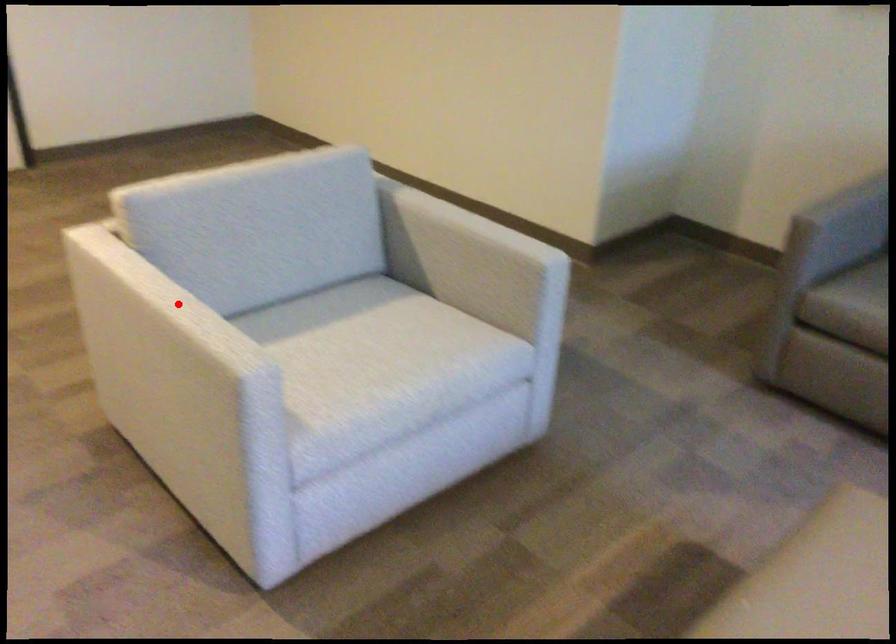
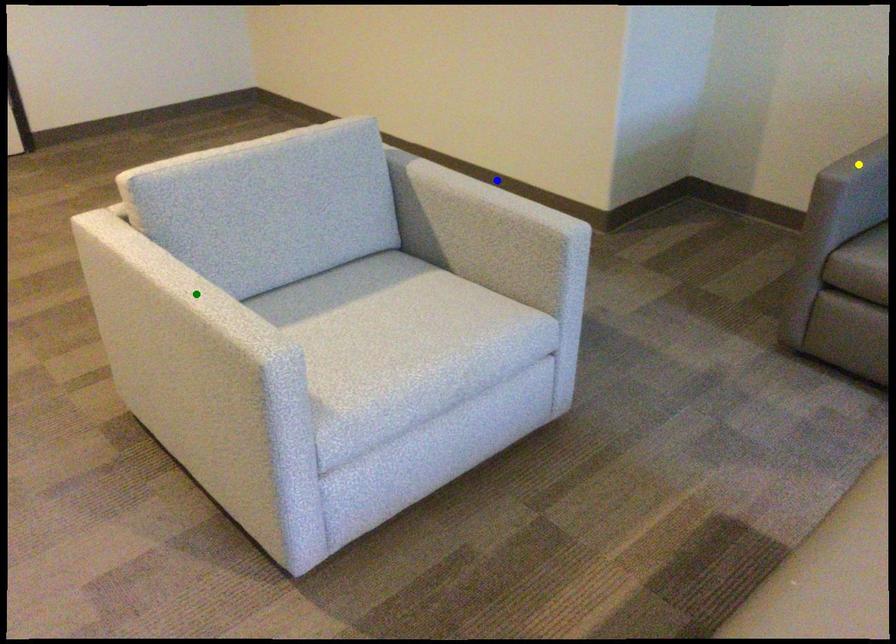
Question: I am providing you with two images of the same scene from different viewpoints. A red point is marked on the first image. You are given multiple points on the second image. Which point in image 2 is actually the same real-world point as the red point in image 1?

Choices:
 (A) blue point
 (B) green point
 (C) yellow point

Answer: (B)